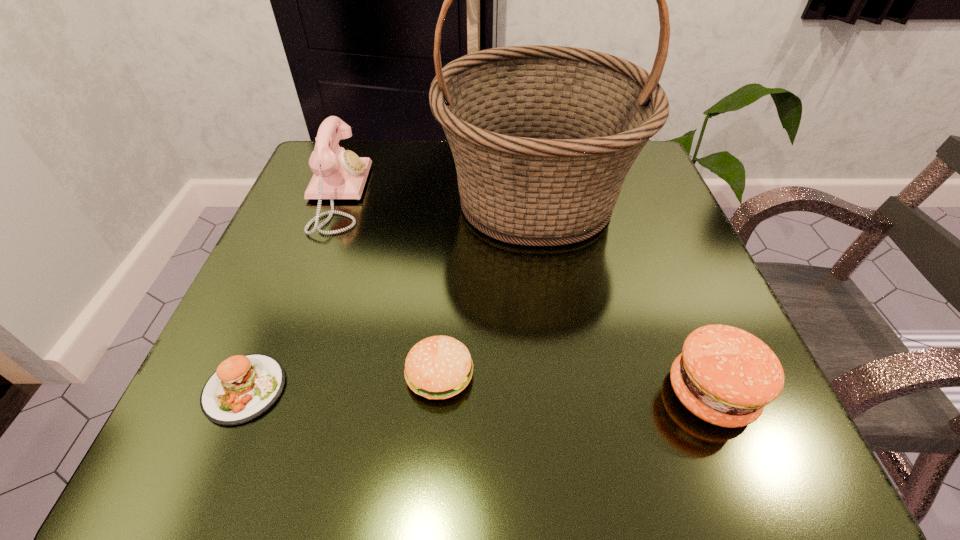
Identify the location of the tallest object. The height and width of the screenshot is (540, 960). (543, 137).

Where is `telephone`? telephone is located at coordinates (338, 174).

The image size is (960, 540). I want to click on the tallest patty, so click(x=725, y=376).

The image size is (960, 540). I want to click on the rightmost patty, so click(725, 376).

Where is `the second shortest object`? the second shortest object is located at coordinates (438, 367).

The image size is (960, 540). What are the coordinates of `the second tallest patty` in the screenshot? It's located at (438, 367).

Find the location of a particular element. the leftmost patty is located at coordinates (243, 387).

The image size is (960, 540). I want to click on the shortest object, so click(243, 387).

Identify the location of free space located 0.290m on the front of the tallest object. Image resolution: width=960 pixels, height=540 pixels. (567, 424).

Identify the location of free space located 0.120m on the dial of the telephone. This screenshot has height=540, width=960. (422, 195).